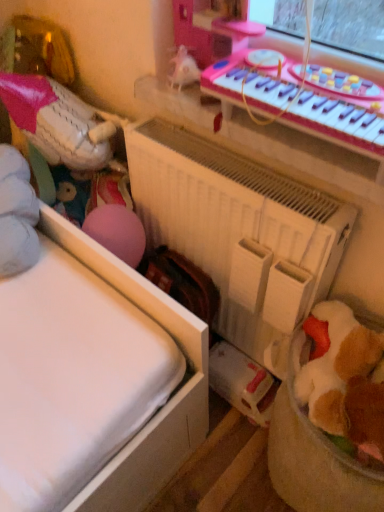
Question: From a real-world perspective, does white matte baseball glove at left, the 1th toy positioned from the top, stand above white matte radiator at center?

Choices:
 (A) yes
 (B) no

Answer: (A)

Question: Can you confirm if white matte baseball glove at left, the 2th toy positioned from the bottom, is wider than white matte radiator at center?

Choices:
 (A) no
 (B) yes

Answer: (B)

Question: Is white matte baseball glove at left, the first toy viewed from the left, bigger than white matte radiator at center?

Choices:
 (A) no
 (B) yes

Answer: (A)

Question: Is white matte baseball glove at left, the 1th toy positioned from the top, with white matte radiator at center?

Choices:
 (A) yes
 (B) no

Answer: (B)

Question: From a real-world perspective, is white matte baseball glove at left, the 1th toy positioned from the top, positioned under white matte radiator at center based on gravity?

Choices:
 (A) no
 (B) yes

Answer: (A)

Question: Is point (163, 233) positioned closer to the camera than point (311, 70)?

Choices:
 (A) farther
 (B) closer

Answer: (A)

Question: In terms of height, does white matte radiator at center look taller or shorter compared to pink plastic musical keyboard at upper right?

Choices:
 (A) short
 (B) tall

Answer: (B)

Question: Considering the positions of white matte radiator at center and pink plastic musical keyboard at upper right in the image, is white matte radiator at center bigger or smaller than pink plastic musical keyboard at upper right?

Choices:
 (A) big
 (B) small

Answer: (A)

Question: In the image, is white matte radiator at center positioned in front of or behind pink plastic musical keyboard at upper right?

Choices:
 (A) front
 (B) behind

Answer: (B)

Question: Visually, is pink plastic musical keyboard at upper right positioned to the left or to the right of white matte radiator at center?

Choices:
 (A) right
 (B) left

Answer: (A)

Question: From the image's perspective, relative to white matte radiator at center, is pink plastic musical keyboard at upper right above or below?

Choices:
 (A) below
 (B) above

Answer: (B)

Question: Considering their positions, is pink plastic musical keyboard at upper right located in front of or behind white matte radiator at center?

Choices:
 (A) behind
 (B) front

Answer: (B)

Question: Considering the positions of point (342, 136) and point (213, 156), is point (342, 136) closer or farther from the camera than point (213, 156)?

Choices:
 (A) closer
 (B) farther

Answer: (A)

Question: Do you think white matte radiator at center is within white matte baseball glove at left, which is the first toy from back to front, or outside of it?

Choices:
 (A) inside
 (B) outside

Answer: (B)

Question: In terms of height, does white matte radiator at center look taller or shorter compared to white matte baseball glove at left, the 2th toy positioned from the bottom?

Choices:
 (A) tall
 (B) short

Answer: (A)